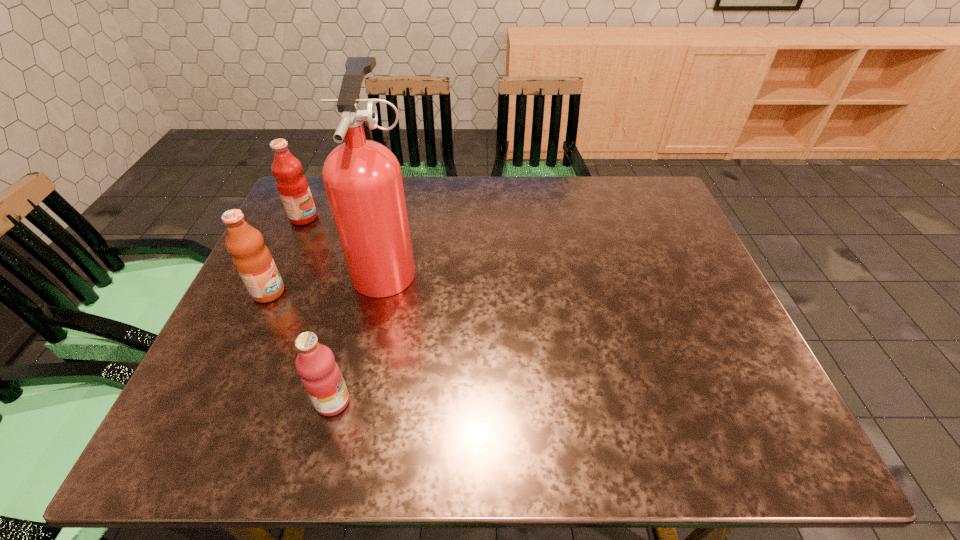
The height and width of the screenshot is (540, 960). Identify the location of free space between the second nearest fruit juice and the farthest object. (286, 255).

The height and width of the screenshot is (540, 960). What are the coordinates of `empty space that is in between the farthest fruit juice and the rightmost fruit juice` in the screenshot? It's located at (319, 310).

Where is `free space between the second nearest fruit juice and the farthest object`? free space between the second nearest fruit juice and the farthest object is located at coordinates (286, 255).

The width and height of the screenshot is (960, 540). Identify the location of empty location between the farthest fruit juice and the shortest object. pos(319,310).

This screenshot has height=540, width=960. What are the coordinates of `free space between the nearest fruit juice and the tallest object` in the screenshot? It's located at [360, 334].

At what (x,y) coordinates should I click in order to perform the action: click on vacant point located between the farthest object and the second farthest fruit juice. Please return your answer as a coordinate pair (x, y). This screenshot has height=540, width=960. Looking at the image, I should click on (286, 255).

Where is `the closest object to the farthest object`? This screenshot has height=540, width=960. the closest object to the farthest object is located at coordinates (362, 178).

Choose which object is the third nearest neighbor to the farthest object. Please provide its 2D coordinates. Your answer should be formatted as a tuple, i.e. [(x, y)], where the tuple contains the x and y coordinates of a point satisfying the conditions above.

[(320, 374)]

Identify the location of fruit juice object that ranks as the second closest to the shortest fruit juice. (292, 185).

Locate which fruit juice is the closest to the nearest object. Please provide its 2D coordinates. Your answer should be formatted as a tuple, i.e. [(x, y)], where the tuple contains the x and y coordinates of a point satisfying the conditions above.

[(252, 259)]